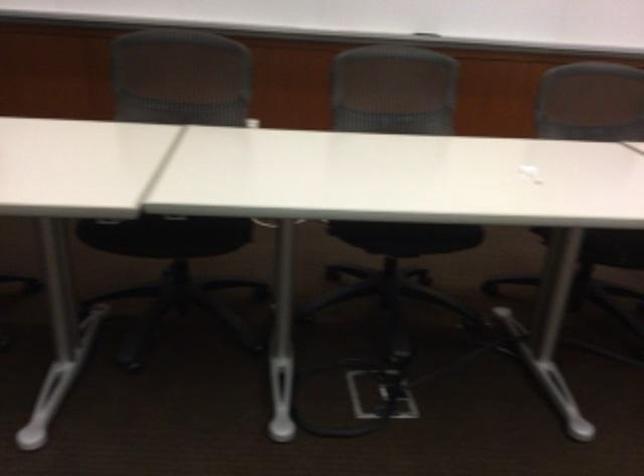
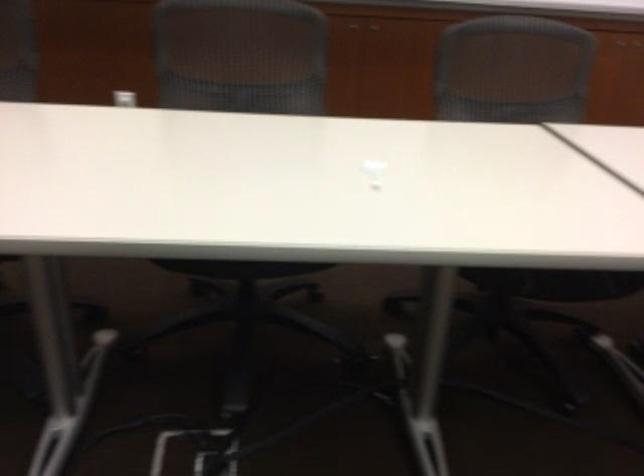
Question: I am providing you with two images of the same scene from different viewpoints. Please identify which objects are invisible in image2.

Choices:
 (A) white chair lever
 (B) black spray bottle trigger
 (C) chair sitting surface
 (D) grey chair sitting surface

Answer: (C)